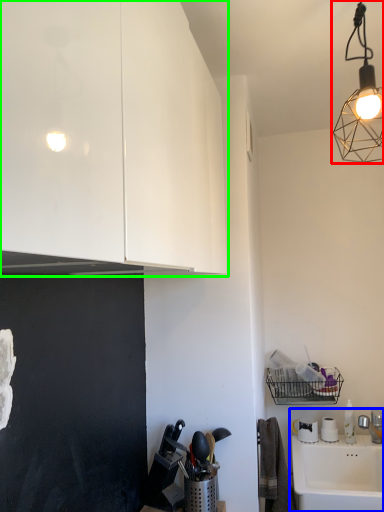
Question: Considering the real-world distances, which object is closest to lamp (highlighted by a red box)? sink (highlighted by a blue box) or cabinetry (highlighted by a green box).

Choices:
 (A) sink
 (B) cabinetry

Answer: (B)